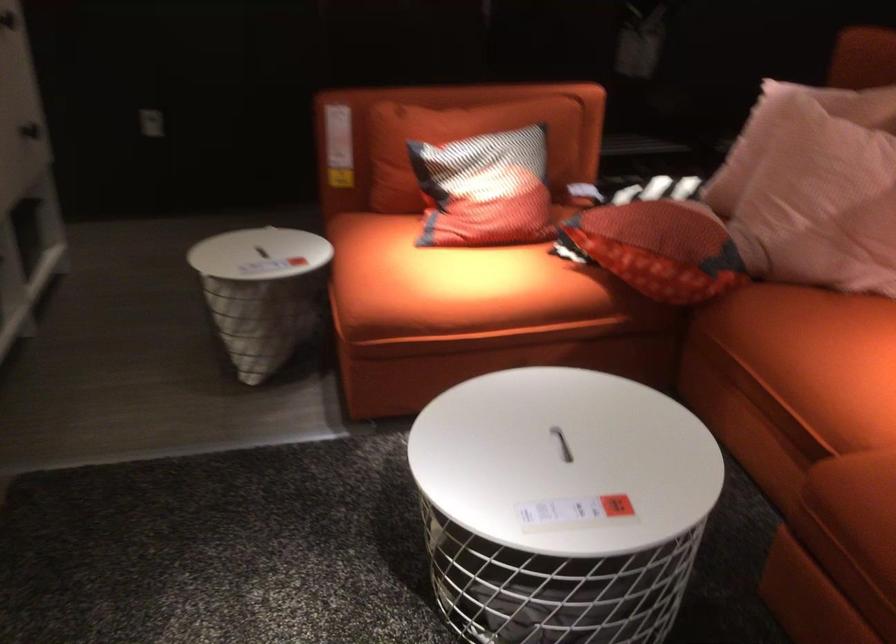
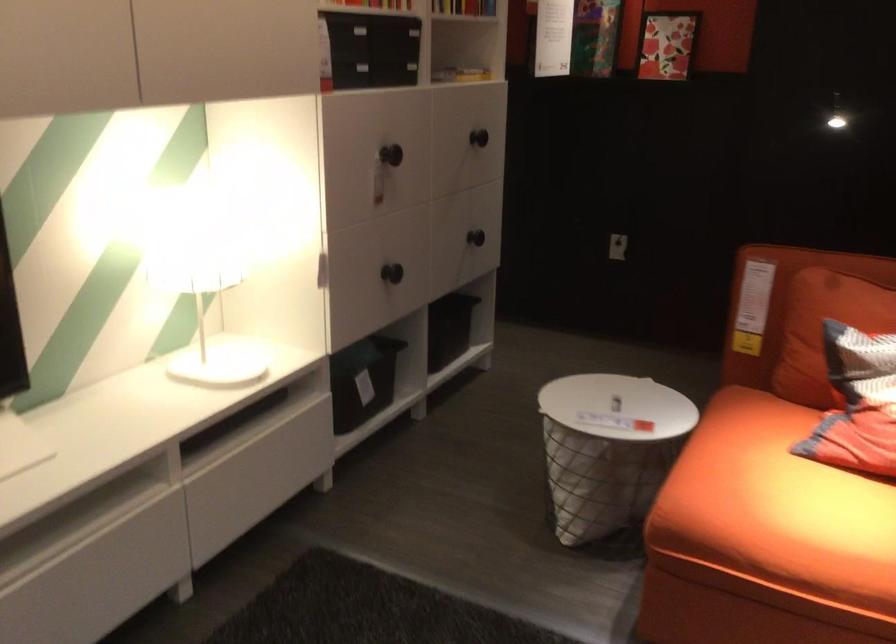
Question: The images are taken continuously from a first-person perspective. In which direction is your viewpoint rotating?

Choices:
 (A) Left
 (B) Right
 (C) Up
 (D) Down

Answer: (A)